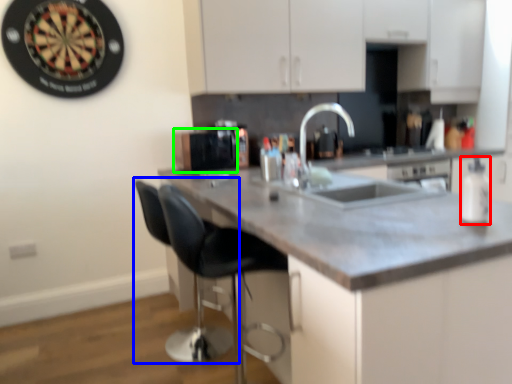
Question: Estimate the real-world distances between objects in this image. Which object is farther from bottle (highlighted by a red box), swivel chair (highlighted by a blue box) or appliance (highlighted by a green box)?

Choices:
 (A) swivel chair
 (B) appliance

Answer: (B)